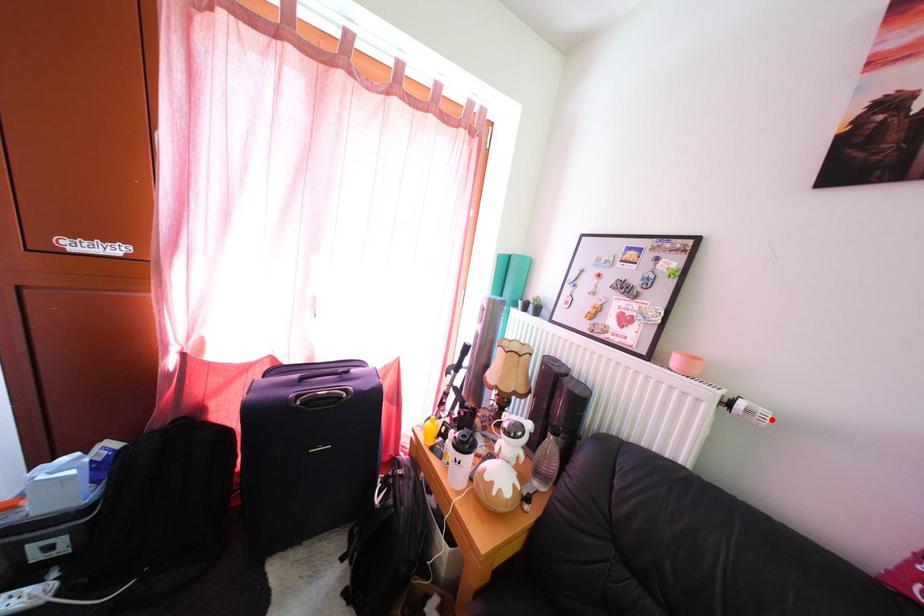
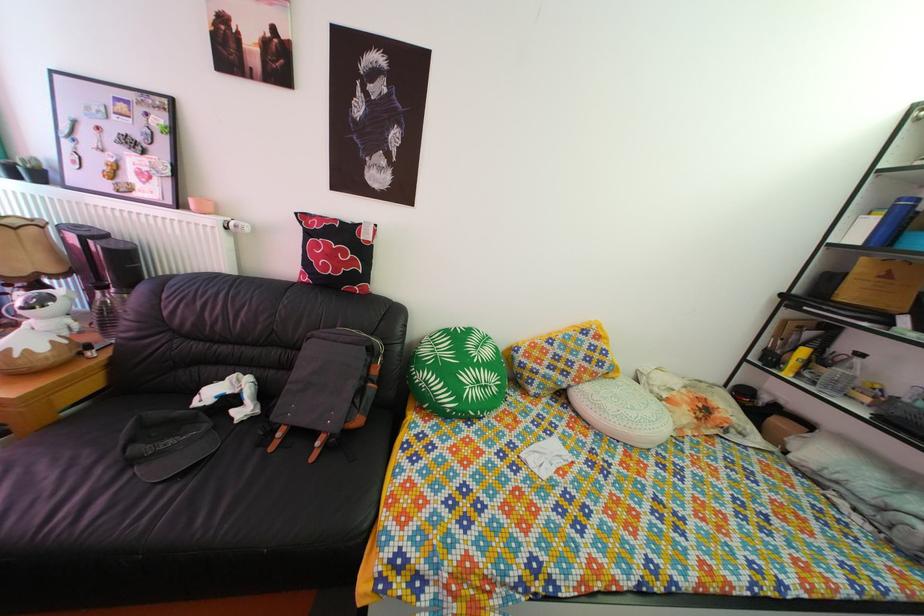
Where in the second image is the point corresponding to the highlighted location from the first image?

(249, 232)